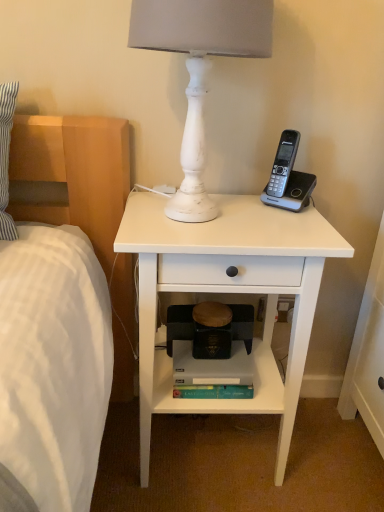
Question: Relative to wooden step stool at center, is white distressed wood lamp at upper center in front or behind?

Choices:
 (A) behind
 (B) front

Answer: (B)

Question: Visually, is white distressed wood lamp at upper center positioned to the left or to the right of wooden step stool at center?

Choices:
 (A) left
 (B) right

Answer: (A)

Question: Which is nearer to the white matte nightstand at center?

Choices:
 (A) gray matte bookshelf at lower center
 (B) wooden step stool at center
 (C) white distressed wood lamp at upper center

Answer: (A)

Question: Estimate the real-world distances between objects in this image. Which object is closer to the white matte nightstand at center?

Choices:
 (A) gray matte bookshelf at lower center
 (B) wooden step stool at center
 (C) white distressed wood lamp at upper center

Answer: (A)